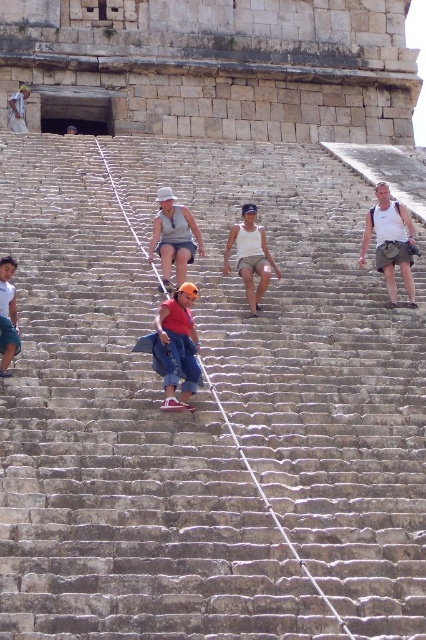
You are a photographer trying to capture a group photo of the people on the staircase. You notice two people wearing a matte gray tank top at center and a white tank top at center. Which person should you ask to move forward to make them appear taller in the photo?

The matte gray tank top at center has a lesser height compared to white tank top at center, so you should ask the person wearing the matte gray tank top at center to move forward to appear taller in the photo.

You are standing at the bottom of the large stone staircase and see the matte gray tank top at center. Where exactly is it located in terms of coordinates?

The matte gray tank top at center is located at point coordinates of (173, 237).

You are a photographer standing at the bottom of the large stone staircase. You want to take a photo of the matte gray tank top at center and the white tank top at center. Which one will appear closer to the camera in the photo?

The matte gray tank top at center is in front of the white tank top at center, so it will appear closer to the camera in the photo.